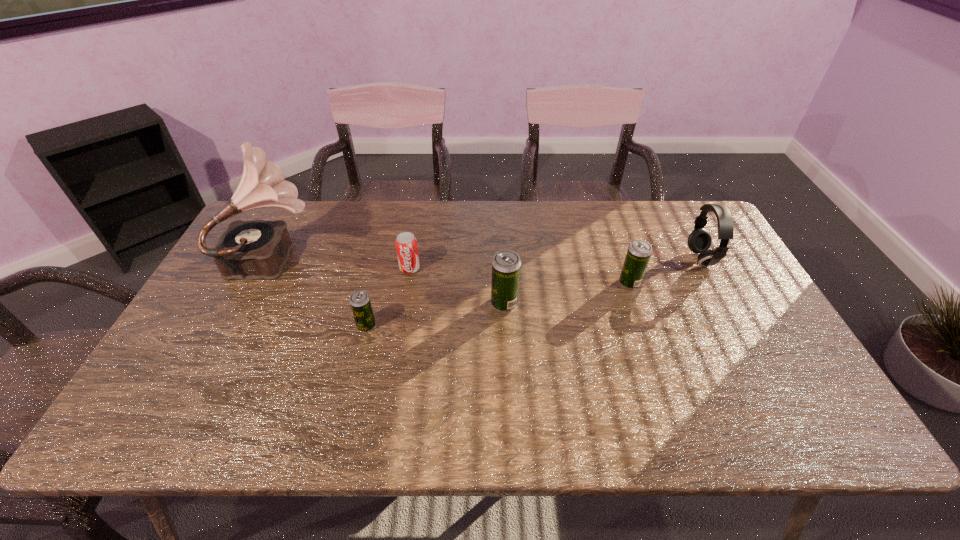
The width and height of the screenshot is (960, 540). Find the location of `free space that is in between the fifth object from right to left and the second beer can from left to right`. free space that is in between the fifth object from right to left and the second beer can from left to right is located at coordinates (435, 315).

Locate an element on the screen. free space between the soda can and the nearest beer can is located at coordinates (388, 297).

Locate an element on the screen. This screenshot has width=960, height=540. object that stands as the second closest to the earphone is located at coordinates (506, 265).

Identify the location of object identified as the closest to the rightmost object. Image resolution: width=960 pixels, height=540 pixels. (638, 254).

At what (x,y) coordinates should I click in order to perform the action: click on beer can identified as the second closest to the second nearest beer can. Please return your answer as a coordinate pair (x, y). Looking at the image, I should click on (359, 301).

Identify the location of the closest beer can to the earphone. (638, 254).

Locate an element on the screen. The width and height of the screenshot is (960, 540). vacant space that satisfies the following two spatial constraints: 1. on the logo side of the fifth object from left to right; 2. on the right side of the soda can is located at coordinates [x=407, y=283].

Identify the location of free point that satisfies the following two spatial constraints: 1. from the horn of the tallest object; 2. on the back side of the second nearest object. (252, 303).

The width and height of the screenshot is (960, 540). I want to click on vacant space that satisfies the following two spatial constraints: 1. from the horn of the record player; 2. on the left side of the fifth farthest object, so coord(252,303).

Image resolution: width=960 pixels, height=540 pixels. I want to click on blank space that satisfies the following two spatial constraints: 1. on the logo side of the fourth object from right to left; 2. on the left side of the third object from right to left, so click(404, 303).